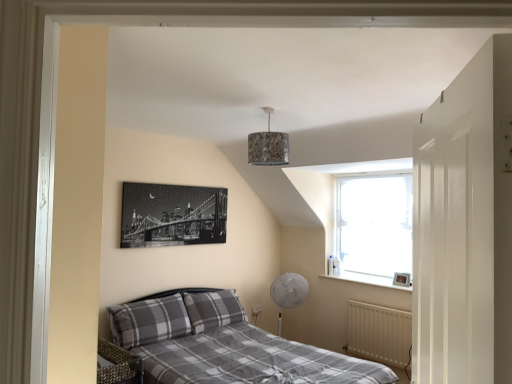
Question: Considering the positions of white textured window at upper right and gray plaid pillow at lower left, placed as the 2th pillow when sorted from right to left, in the image, is white textured window at upper right taller or shorter than gray plaid pillow at lower left, placed as the 2th pillow when sorted from right to left,?

Choices:
 (A) tall
 (B) short

Answer: (A)

Question: Is point (375, 173) closer or farther from the camera than point (145, 326)?

Choices:
 (A) farther
 (B) closer

Answer: (A)

Question: Estimate the real-world distances between objects in this image. Which object is farther from the white matte radiator at lower right?

Choices:
 (A) camouflage fabric lampshade at center
 (B) plaid fabric bed at center
 (C) black and white canvas at upper left, the first picture frame from the top
 (D) gray plaid pillow at center, which is the second pillow in left-to-right order
 (E) white glossy door at right

Answer: (E)

Question: Which is nearer to the plaid fabric bed at center?

Choices:
 (A) black and white canvas at upper left, the first picture frame from the top
 (B) white textured window at upper right
 (C) metallic silver picture frame at upper right, the first picture frame positioned from the right
 (D) camouflage fabric lampshade at center
 (E) white glossy door at right

Answer: (A)